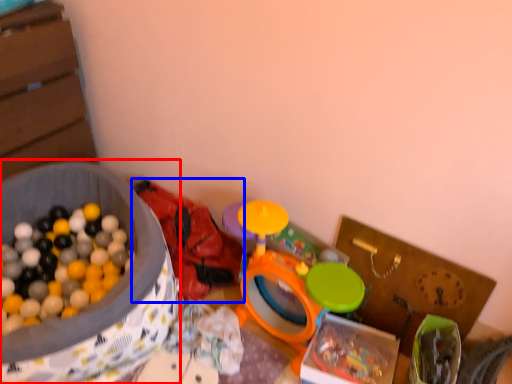
Question: Among these objects, which one is nearest to the camera, box (highlighted by a red box) or toy (highlighted by a blue box)?

Choices:
 (A) box
 (B) toy

Answer: (A)